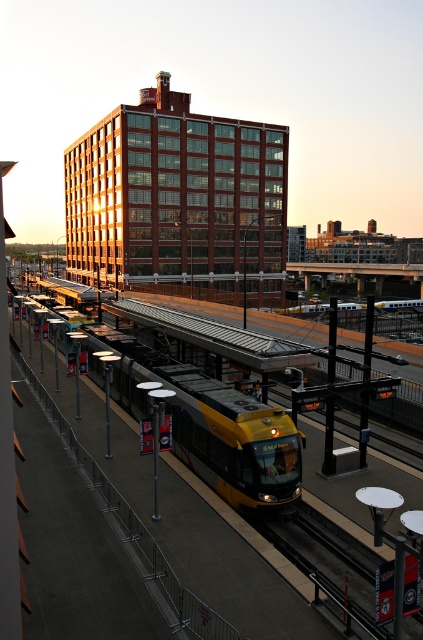
Measure the distance between point (165, 364) and camera.

Point (165, 364) is 20.63 meters from camera.

Does yellow metallic train at center appear on the right side of metallic smooth train track at lower center?

Incorrect, yellow metallic train at center is not on the right side of metallic smooth train track at lower center.

What do you see at coordinates (211, 426) in the screenshot? I see `yellow metallic train at center` at bounding box center [211, 426].

Image resolution: width=423 pixels, height=640 pixels. What are the coordinates of `yellow metallic train at center` in the screenshot? It's located at point(211,426).